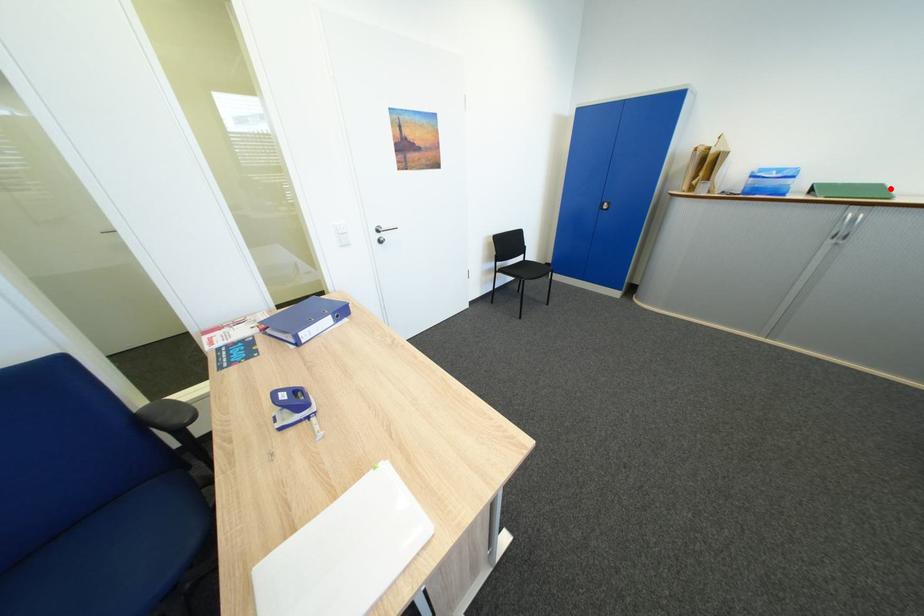
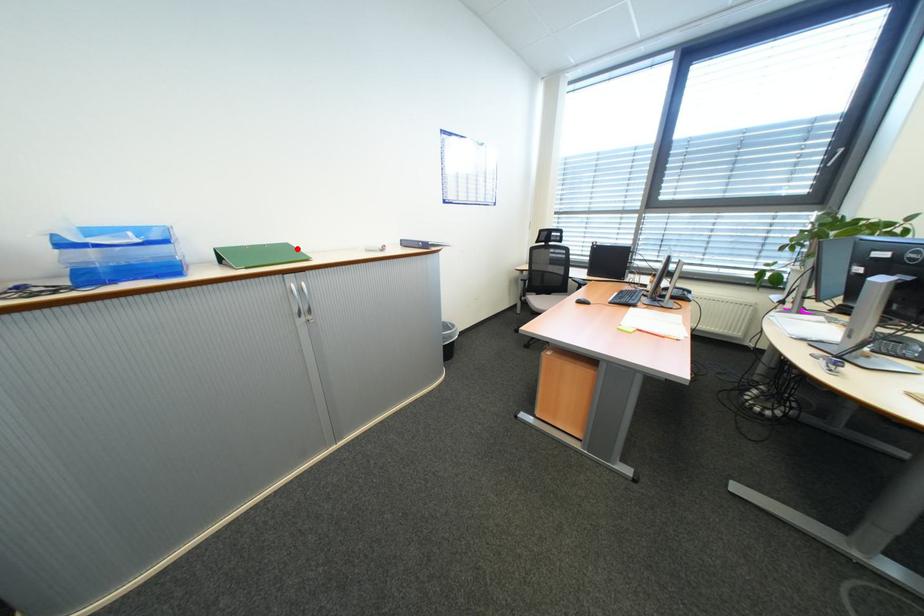
I am providing you with two images of the same scene from different viewpoints. A red point is marked on the first image and another point is marked on the second image. Are the points marked in image1 and image2 representing the same 3D position?

Yes